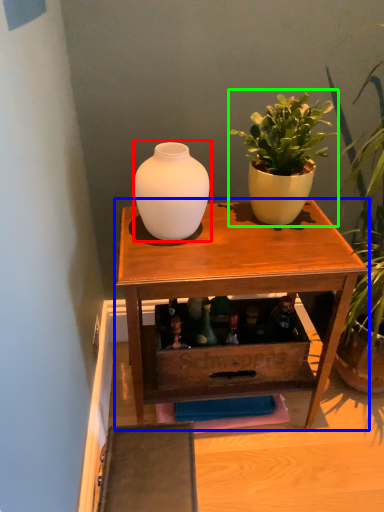
Question: Estimate the real-world distances between objects in this image. Which object is closer to vase (highlighted by a red box), table (highlighted by a blue box) or houseplant (highlighted by a green box)?

Choices:
 (A) table
 (B) houseplant

Answer: (B)